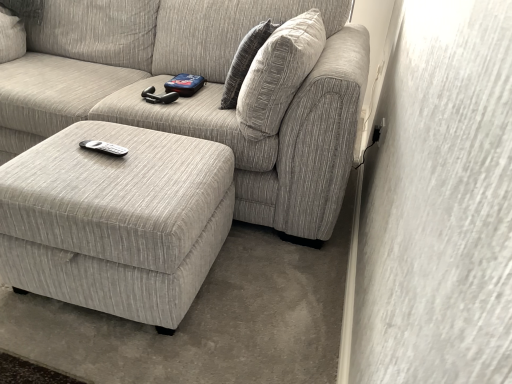
At what (x,y) coordinates should I click in order to perform the action: click on matte gray ottoman at lower left. Please return your answer as a coordinate pair (x, y). This screenshot has width=512, height=384. Looking at the image, I should click on (116, 220).

From a real-world perspective, is textured beige couch at center physically located above or below matte gray ottoman at lower left?

In terms of real-world spatial position, textured beige couch at center is above matte gray ottoman at lower left.

Between textured beige couch at center and matte gray ottoman at lower left, which one has smaller size?

Smaller between the two is matte gray ottoman at lower left.

Does textured beige couch at center have a lesser width compared to matte gray ottoman at lower left?

In fact, textured beige couch at center might be wider than matte gray ottoman at lower left.

Is textured beige couch at center to the left or to the right of matte gray ottoman at lower left in the image?

textured beige couch at center is positioned on matte gray ottoman at lower left's left side.

Considering the relative sizes of matte gray ottoman at lower left and textured gray pillow at upper right in the image provided, is matte gray ottoman at lower left smaller than textured gray pillow at upper right?

No.

Does matte gray ottoman at lower left turn towards textured gray pillow at upper right?

No.

Considering the relative sizes of matte gray ottoman at lower left and textured gray pillow at upper right in the image provided, is matte gray ottoman at lower left wider than textured gray pillow at upper right?

Yes.

Can you confirm if matte gray ottoman at lower left is shorter than textured gray pillow at upper right?

Yes, matte gray ottoman at lower left is shorter than textured gray pillow at upper right.

Relative to textured beige couch at center, is matte gray ottoman at lower left in front or behind?

matte gray ottoman at lower left is in front of textured beige couch at center.

From a real-world perspective, which object stands above the other?

textured beige couch at center.

Considering the sizes of matte gray ottoman at lower left and textured beige couch at center in the image, is matte gray ottoman at lower left taller or shorter than textured beige couch at center?

Clearly, matte gray ottoman at lower left is shorter compared to textured beige couch at center.

Is matte gray ottoman at lower left looking in the opposite direction of textured beige couch at center?

Yes.

Who is bigger, textured gray pillow at upper right or textured beige couch at center?

textured beige couch at center is bigger.

Is textured gray pillow at upper right further to camera compared to textured beige couch at center?

That is True.

Does textured gray pillow at upper right turn towards textured beige couch at center?

Yes, textured gray pillow at upper right is facing textured beige couch at center.

From the picture: Can you tell me how much textured gray pillow at upper right and matte gray ottoman at lower left differ in facing direction?

The angular difference between textured gray pillow at upper right and matte gray ottoman at lower left is 88 degrees.

From the image's perspective, between textured gray pillow at upper right and matte gray ottoman at lower left, which one is located above?

textured gray pillow at upper right is shown above in the image.

Considering the relative positions of textured gray pillow at upper right and matte gray ottoman at lower left in the image provided, is textured gray pillow at upper right to the right of matte gray ottoman at lower left from the viewer's perspective?

Correct, you'll find textured gray pillow at upper right to the right of matte gray ottoman at lower left.

Consider the image. Is textured beige couch at center behind textured gray pillow at upper right?

No.

Between textured beige couch at center and textured gray pillow at upper right, which one has larger width?

textured beige couch at center is wider.

From the image's perspective, which one is positioned higher, textured beige couch at center or textured gray pillow at upper right?

textured beige couch at center.

Are textured beige couch at center and textured gray pillow at upper right beside each other?

textured beige couch at center and textured gray pillow at upper right are not in contact.

Locate an element on the screen. This screenshot has width=512, height=384. table that is on the right side of textured beige couch at center is located at coordinates (116, 220).

Where is `table located below the textured gray pillow at upper right (from the image's perspective)`? The image size is (512, 384). table located below the textured gray pillow at upper right (from the image's perspective) is located at coordinates (116, 220).

Which object lies further to the anchor point textured beige couch at center, matte gray ottoman at lower left or textured gray pillow at upper right?

Among the two, matte gray ottoman at lower left is located further to textured beige couch at center.

Based on their spatial positions, is textured beige couch at center or matte gray ottoman at lower left closer to textured gray pillow at upper right?

textured beige couch at center.

Considering their positions, is matte gray ottoman at lower left positioned further to textured gray pillow at upper right than textured beige couch at center?

matte gray ottoman at lower left is further to textured gray pillow at upper right.

Considering their positions, is textured gray pillow at upper right positioned further to matte gray ottoman at lower left than textured beige couch at center?

textured gray pillow at upper right.

From the image, which object appears to be nearer to textured beige couch at center, textured gray pillow at upper right or matte gray ottoman at lower left?

Based on the image, textured gray pillow at upper right appears to be nearer to textured beige couch at center.

Estimate the real-world distances between objects in this image. Which object is further from matte gray ottoman at lower left, textured beige couch at center or textured gray pillow at upper right?

Based on the image, textured gray pillow at upper right appears to be further to matte gray ottoman at lower left.

This screenshot has width=512, height=384. Find the location of `pillow between textured beige couch at center and matte gray ottoman at lower left vertically`. pillow between textured beige couch at center and matte gray ottoman at lower left vertically is located at coordinates (244, 61).